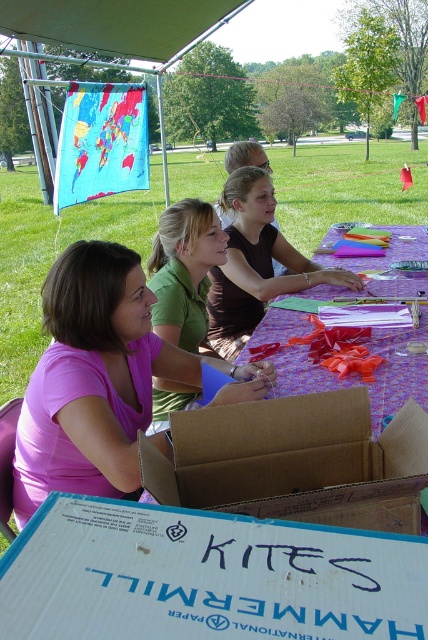
Does cardboard box at center appear on the right side of multicolored paper at center?

In fact, cardboard box at center is to the left of multicolored paper at center.

Does cardboard box at center have a lesser height compared to multicolored paper at center?

Yes, cardboard box at center is shorter than multicolored paper at center.

I want to click on cardboard box at center, so click(x=294, y=460).

Which of these two, multicolored paper at center or green matte shirt at center, stands shorter?

green matte shirt at center is shorter.

Where is `multicolored paper at center`? Image resolution: width=428 pixels, height=640 pixels. multicolored paper at center is located at coordinates (398, 371).

Which is in front, point (425, 369) or point (154, 326)?

Positioned in front is point (425, 369).

You are a GUI agent. You are given a task and a screenshot of the screen. Output one action in this format:
    pyautogui.click(x=<x>, y=<y>)
    Task: Click on the multicolored paper at center
    The width and height of the screenshot is (428, 640).
    Given the screenshot: What is the action you would take?
    pyautogui.click(x=398, y=371)

Can you confirm if cardboard box at center is thinner than green fabric canopy at upper center?

Yes.

Describe the element at coordinates (294, 460) in the screenshot. This screenshot has width=428, height=640. I see `cardboard box at center` at that location.

Identify the location of cardboard box at center. Image resolution: width=428 pixels, height=640 pixels. (294, 460).